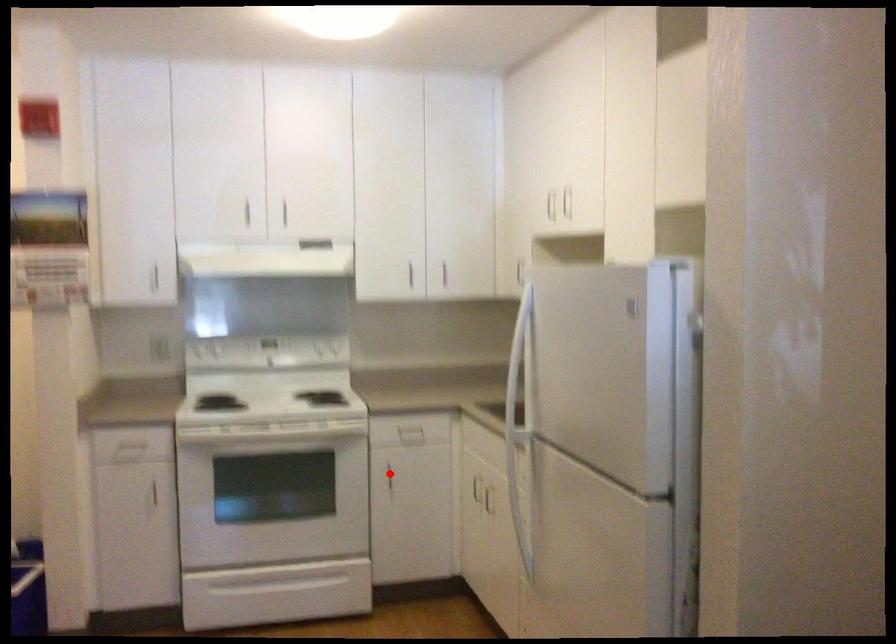
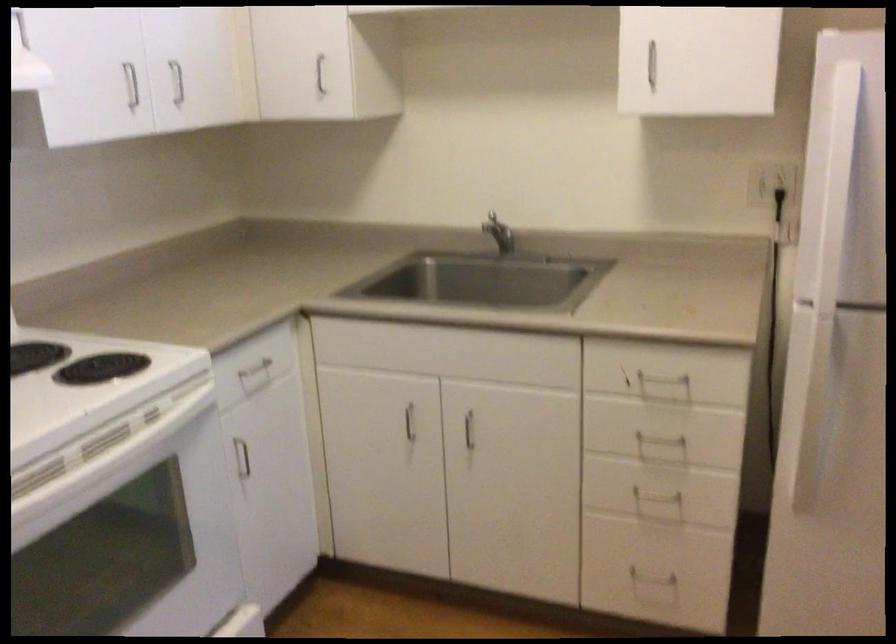
Question: I am providing you with two images of the same scene from different viewpoints. Given a red point in image1, look at the same physical point in image2. Is it:

Choices:
 (A) Closer to the viewpoint
 (B) Farther from the viewpoint

Answer: (A)